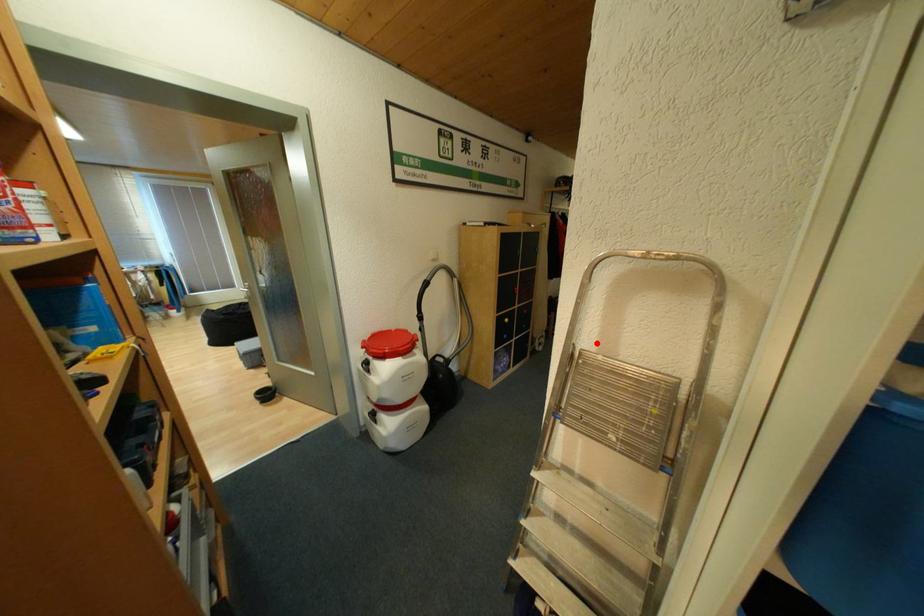
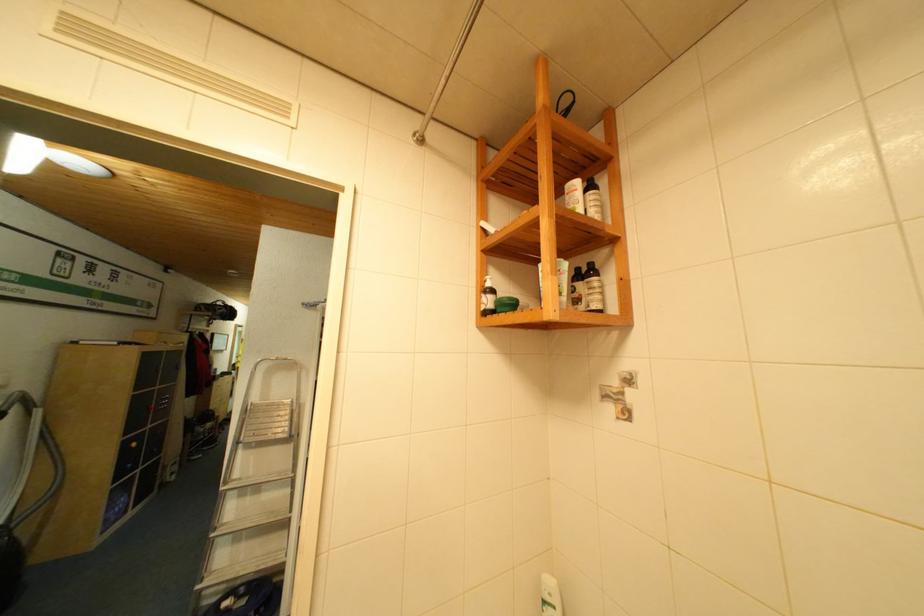
Locate, in the second image, the point that corresponds to the highlighted location in the first image.

(263, 400)